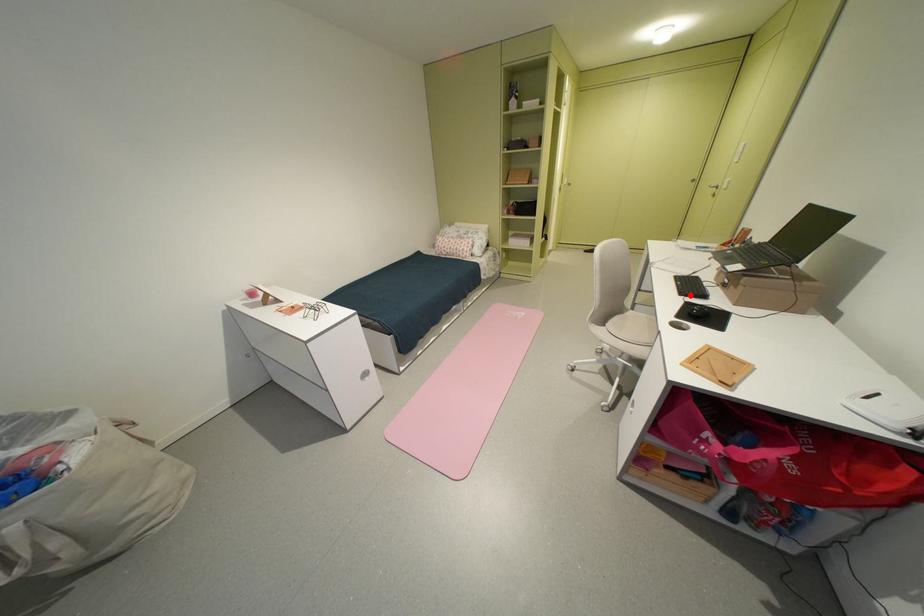
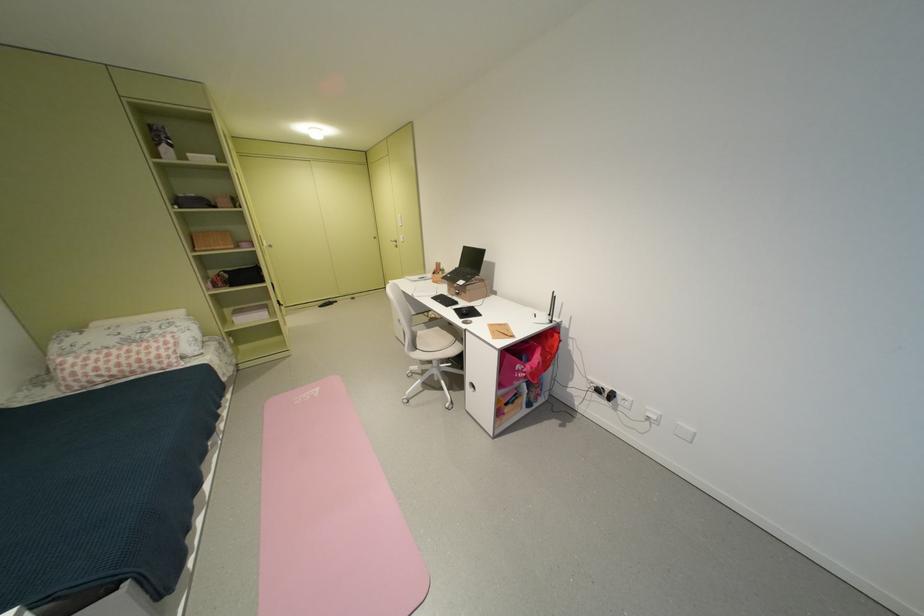
The point at the highlighted location is marked in the first image. Where is the corresponding point in the second image?

(456, 307)